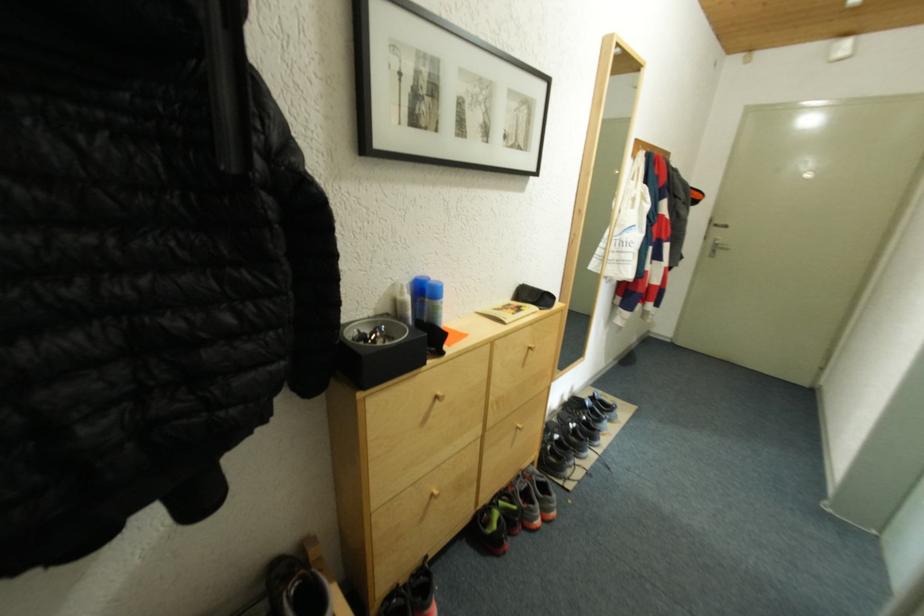
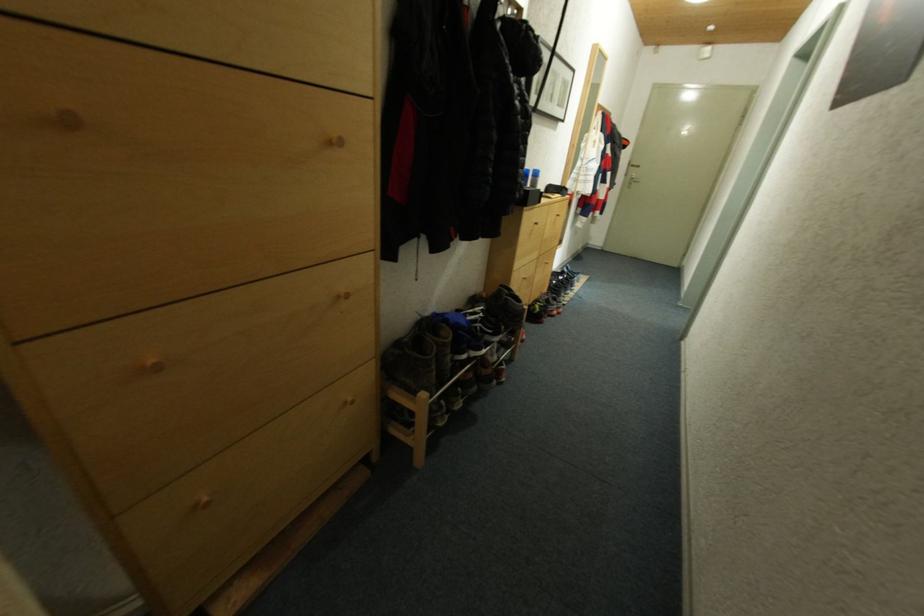
What movement of the cameraman would produce the second image?

The cameraman moved toward left, backward.